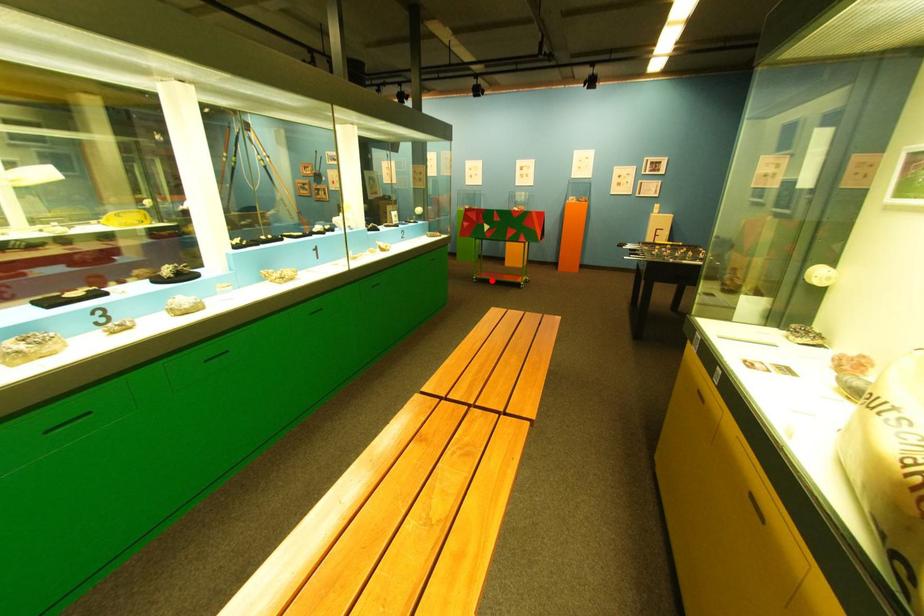
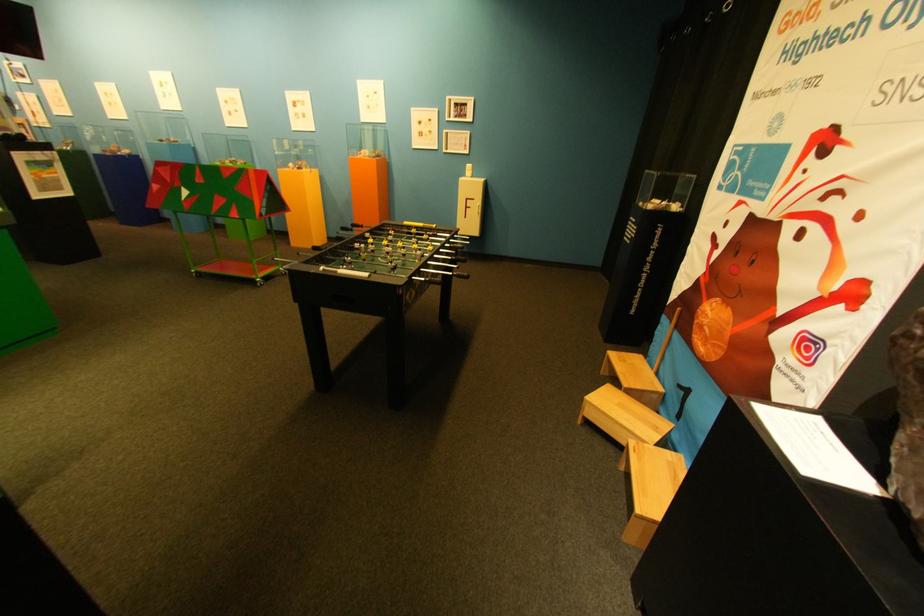
Question: I am providing you with two images of the same scene from different viewpoints. In image1, a red point is highlighted. Considering the same 3D point in image2, which of the following is correct?

Choices:
 (A) It is closer
 (B) It is farther

Answer: (A)